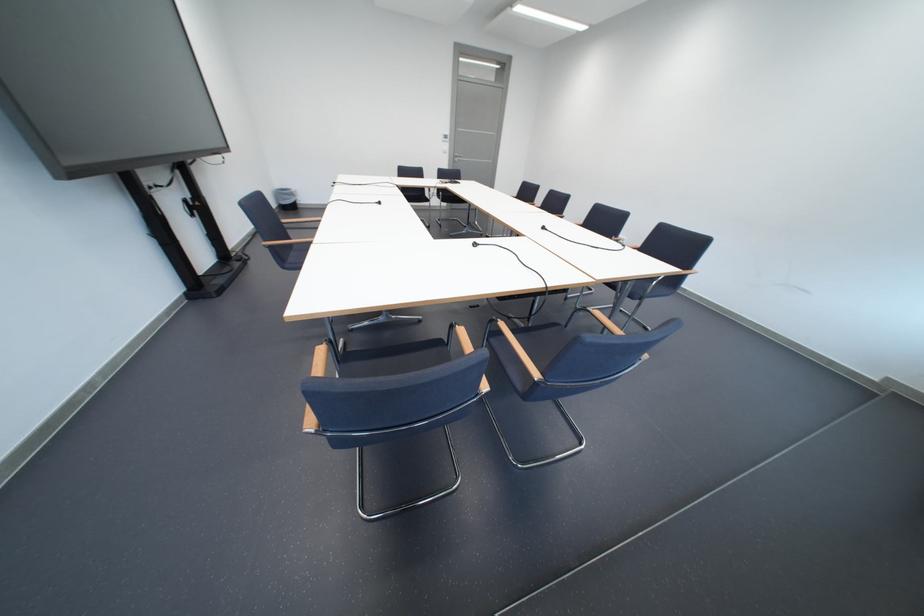
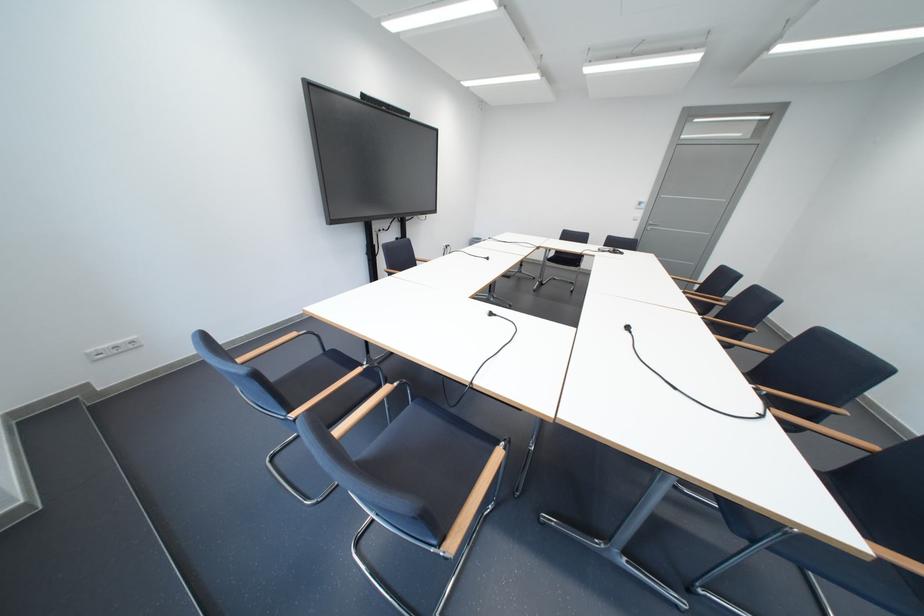
In the second image, find the point that corresponds to [488,246] in the first image.

(503, 315)